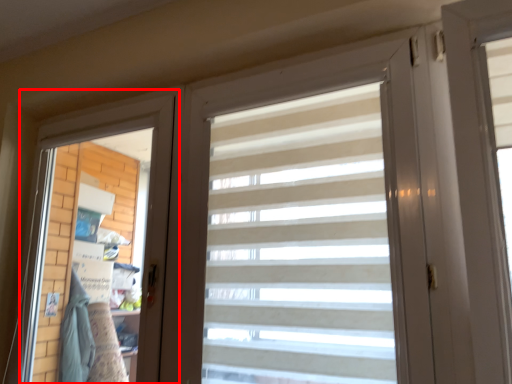
Question: From the image's perspective, where is screen door (annotated by the red box) located relative to curtain?

Choices:
 (A) above
 (B) below

Answer: (B)